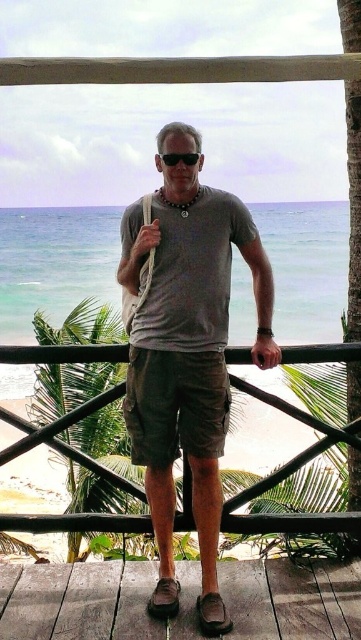
The man is wearing dark green cotton shorts at center and has black plastic goggles at center. Which item is positioned to the right?

The black plastic goggles at center are to the right of the dark green cotton shorts at center.